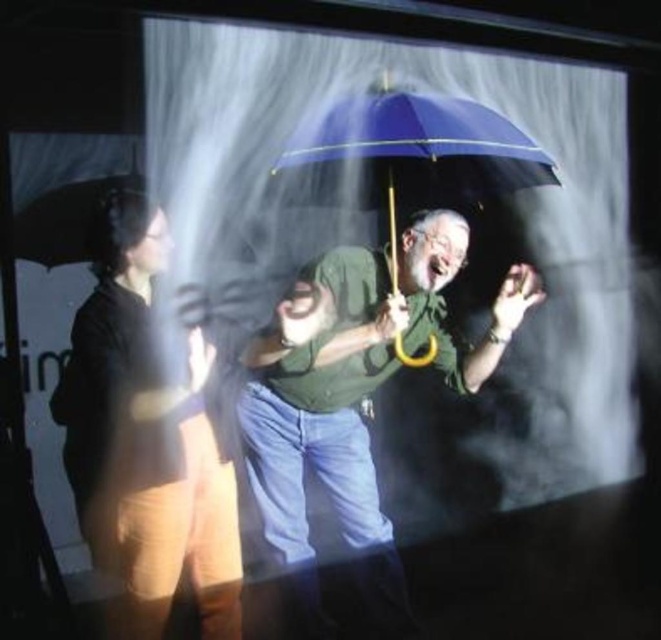
How distant is matte green shirt at center from matte black jacket at left?

22.44 inches

Is point (405, 237) closer to camera compared to point (182, 488)?

No, it is not.

I want to click on matte green shirt at center, so click(x=356, y=394).

Does matte black jacket at left appear on the left side of blue matte umbrella at center?

Correct, you'll find matte black jacket at left to the left of blue matte umbrella at center.

How distant is matte black jacket at left from blue matte umbrella at center?

matte black jacket at left and blue matte umbrella at center are 3.37 feet apart.

Is point (188, 544) less distant than point (483, 116)?

That is False.

Where is `matte black jacket at left`? The image size is (661, 640). matte black jacket at left is located at coordinates (145, 436).

Measure the distance between matte green shirt at center and blue matte umbrella at center.

A distance of 16.16 inches exists between matte green shirt at center and blue matte umbrella at center.

Does matte green shirt at center have a greater width compared to blue matte umbrella at center?

Yes, matte green shirt at center is wider than blue matte umbrella at center.

Image resolution: width=661 pixels, height=640 pixels. Find the location of `matte green shirt at center`. matte green shirt at center is located at coordinates (356, 394).